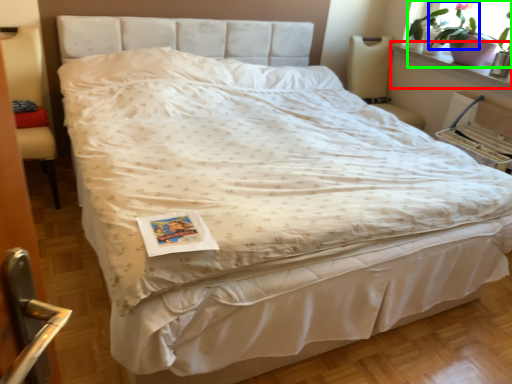
Question: Which object is the closest to the window sill (highlighted by a red box)? Choose among these: plant (highlighted by a blue box) or houseplant (highlighted by a green box).

Choices:
 (A) plant
 (B) houseplant

Answer: (B)